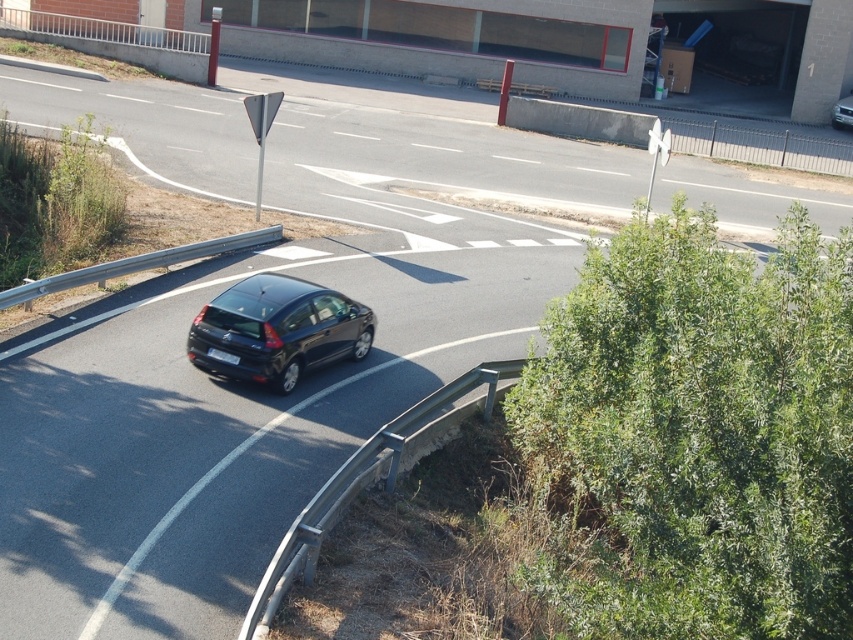
Question: Does smooth asphalt road at center appear over black plastic license plate at center?

Choices:
 (A) yes
 (B) no

Answer: (A)

Question: Which of the following is the closest to the observer?

Choices:
 (A) (497, 177)
 (B) (328, 333)
 (C) (231, 355)

Answer: (C)

Question: Is glossy black hatchback at center wider than black plastic license plate at center?

Choices:
 (A) no
 (B) yes

Answer: (B)

Question: Among these objects, which one is nearest to the camera?

Choices:
 (A) black plastic license plate at center
 (B) glossy black hatchback at center
 (C) smooth asphalt road at center

Answer: (B)

Question: Which of the following is the farthest from the observer?

Choices:
 (A) (238, 356)
 (B) (241, 372)
 (C) (602, 157)

Answer: (C)

Question: Is glossy black hatchback at center wider than black plastic license plate at center?

Choices:
 (A) no
 (B) yes

Answer: (B)